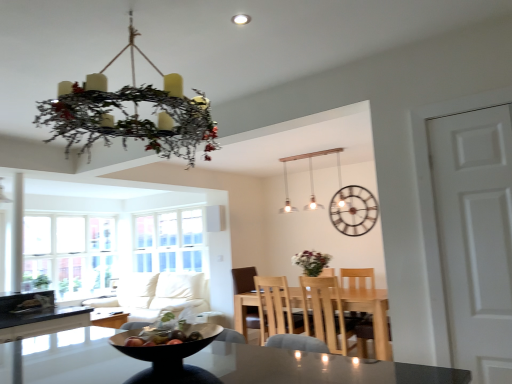
Find the location of a particular element. free space above metallic wire wreath at upper center (from a real-world perspective) is located at coordinates (125, 24).